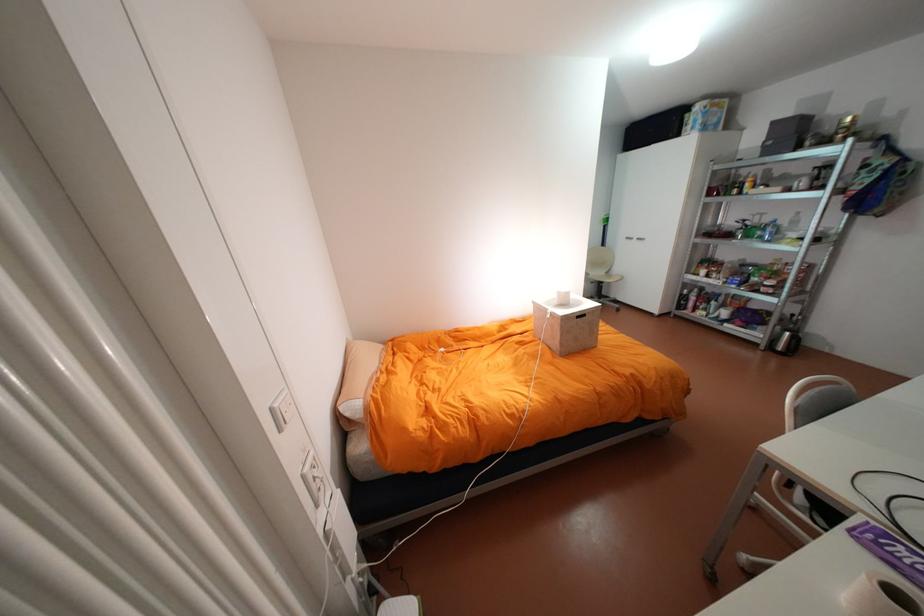
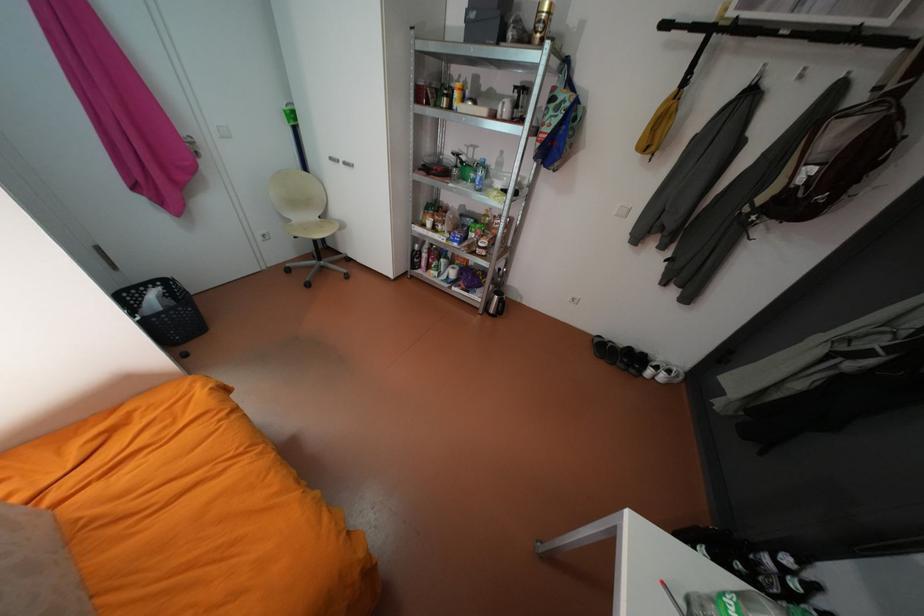
In the second image, find the point that corresponds to (756,236) in the first image.

(471, 177)